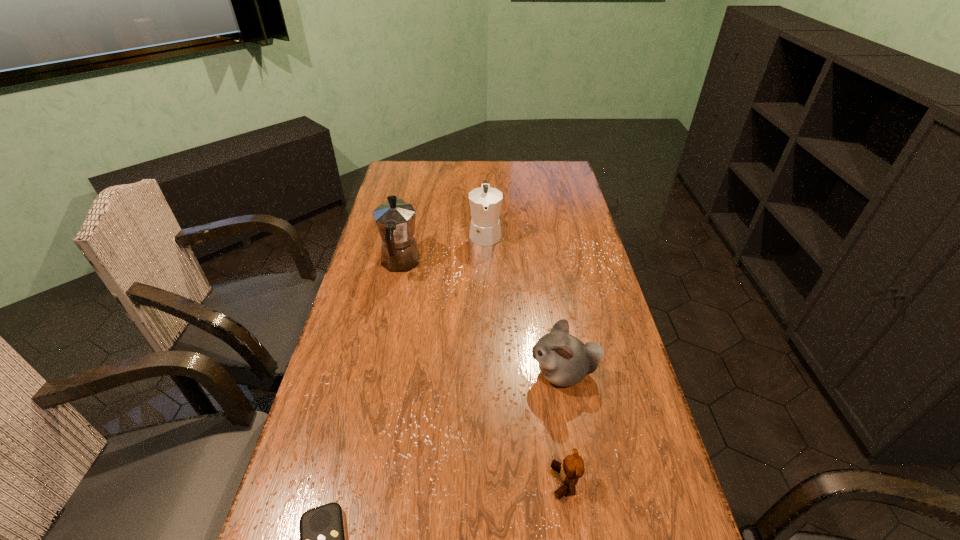
The image size is (960, 540). In the image, there is a desktop. Find the location of `blank space at the far edge`. blank space at the far edge is located at coordinates (437, 168).

Identify the location of blank area at the left edge. This screenshot has height=540, width=960. click(x=369, y=418).

The image size is (960, 540). Find the location of `free space at the right edge of the desktop`. free space at the right edge of the desktop is located at coordinates (569, 217).

I want to click on vacant space at the far right corner of the desktop, so click(540, 172).

Identify the location of free area in between the tallest object and the fourth tallest object. The width and height of the screenshot is (960, 540). (483, 372).

I want to click on vacant area that lies between the third farthest object and the fourth shortest object, so click(x=524, y=303).

Locate an element on the screen. free space that is in between the teddy bear and the hamster is located at coordinates (564, 427).

Identify which object is located as the nearest to the hamster. Please provide its 2D coordinates. Your answer should be formatted as a tuple, i.e. [(x, y)], where the tuple contains the x and y coordinates of a point satisfying the conditions above.

[(572, 468)]

Where is `object that is the third nearest to the nearest object`? object that is the third nearest to the nearest object is located at coordinates point(395,220).